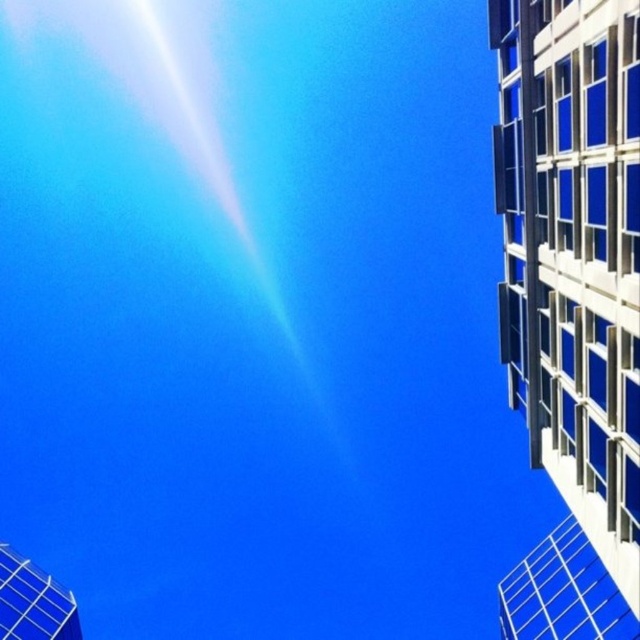
You are standing at the base of the modern building and want to take a photo of the point at coordinates point (515, 172). If your camera has a maximum zoom range of 25 meters, will you be able to capture the point in your photo?

The point (515, 172) is 30.66 meters away from the camera, which exceeds the camera maximum zoom range of 25 meters. Therefore, you will not be able to capture the point in your photo.

You are a photographer trying to capture the white glass building at right and the metallic grid tower at bottom left in a single frame. Given their height difference, which object will appear larger in your photo?

The white glass building at right will appear larger in the photo because it is much taller than the metallic grid tower at bottom left.

You are a drone operator planning to fly a drone from the metallic grid tower at bottom left to the white glass building at right. The drone has a maximum flight range of 120 feet. Based on the scene, can the drone reach its destination?

The distance between the metallic grid tower at bottom left and the white glass building at right is 121.91 feet, which exceeds the drone s maximum flight range of 120 feet. Therefore, the drone cannot reach the white glass building at right from the metallic grid tower at bottom left.